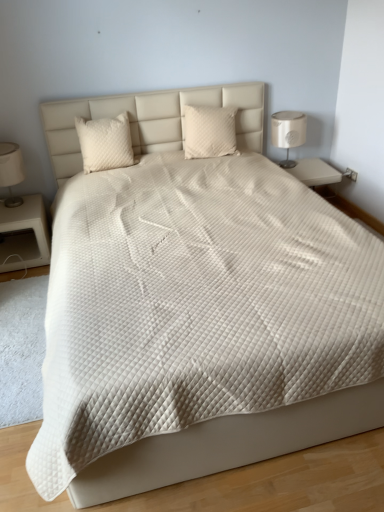
Question: Would you consider quilted beige pillow at center, arranged as the 2th pillow when viewed from the left, to be distant from white matte nightstand at left?

Choices:
 (A) yes
 (B) no

Answer: (A)

Question: Is quilted beige pillow at center, arranged as the 2th pillow when viewed from the left, aimed at white matte nightstand at left?

Choices:
 (A) no
 (B) yes

Answer: (A)

Question: Is quilted beige pillow at center, positioned as the 1th pillow in right-to-left order, turned away from white matte nightstand at left?

Choices:
 (A) yes
 (B) no

Answer: (B)

Question: Can you confirm if quilted beige pillow at center, positioned as the 1th pillow in right-to-left order, is bigger than white matte nightstand at left?

Choices:
 (A) yes
 (B) no

Answer: (B)

Question: Does quilted beige pillow at center, arranged as the 2th pillow when viewed from the left, have a lesser height compared to white matte nightstand at left?

Choices:
 (A) no
 (B) yes

Answer: (B)

Question: Visually, is white soft carpet at lower left positioned to the left or to the right of white matte nightstand at left?

Choices:
 (A) left
 (B) right

Answer: (B)

Question: Looking at the image, does white soft carpet at lower left seem bigger or smaller compared to white matte nightstand at left?

Choices:
 (A) small
 (B) big

Answer: (A)

Question: From their relative heights in the image, would you say white soft carpet at lower left is taller or shorter than white matte nightstand at left?

Choices:
 (A) short
 (B) tall

Answer: (A)

Question: Is white soft carpet at lower left situated inside white matte nightstand at left or outside?

Choices:
 (A) inside
 (B) outside

Answer: (B)

Question: Considering the positions of matte white lampshade at left, positioned as the 2th bedside lamp in right-to-left order, and white quilted pillow at upper left, the first pillow in the left-to-right sequence, in the image, is matte white lampshade at left, positioned as the 2th bedside lamp in right-to-left order, bigger or smaller than white quilted pillow at upper left, the first pillow in the left-to-right sequence,?

Choices:
 (A) big
 (B) small

Answer: (A)

Question: In terms of height, does matte white lampshade at left, which appears as the first bedside lamp when viewed from the left, look taller or shorter compared to white quilted pillow at upper left, the 2th pillow when ordered from right to left?

Choices:
 (A) short
 (B) tall

Answer: (B)

Question: Considering their positions, is matte white lampshade at left, which appears as the first bedside lamp when viewed from the left, located in front of or behind white quilted pillow at upper left, the 2th pillow when ordered from right to left?

Choices:
 (A) behind
 (B) front

Answer: (B)

Question: From a real-world perspective, relative to white quilted pillow at upper left, the 2th pillow when ordered from right to left, is matte white lampshade at left, which appears as the first bedside lamp when viewed from the left, vertically above or below?

Choices:
 (A) below
 (B) above

Answer: (A)

Question: Is white quilted pillow at upper left, the first pillow in the left-to-right sequence, inside or outside of matte white lampshade at left, which appears as the first bedside lamp when viewed from the left?

Choices:
 (A) outside
 (B) inside

Answer: (A)

Question: From the image's perspective, is white quilted pillow at upper left, the first pillow in the left-to-right sequence, located above or below matte white lampshade at left, positioned as the 2th bedside lamp in right-to-left order?

Choices:
 (A) above
 (B) below

Answer: (A)